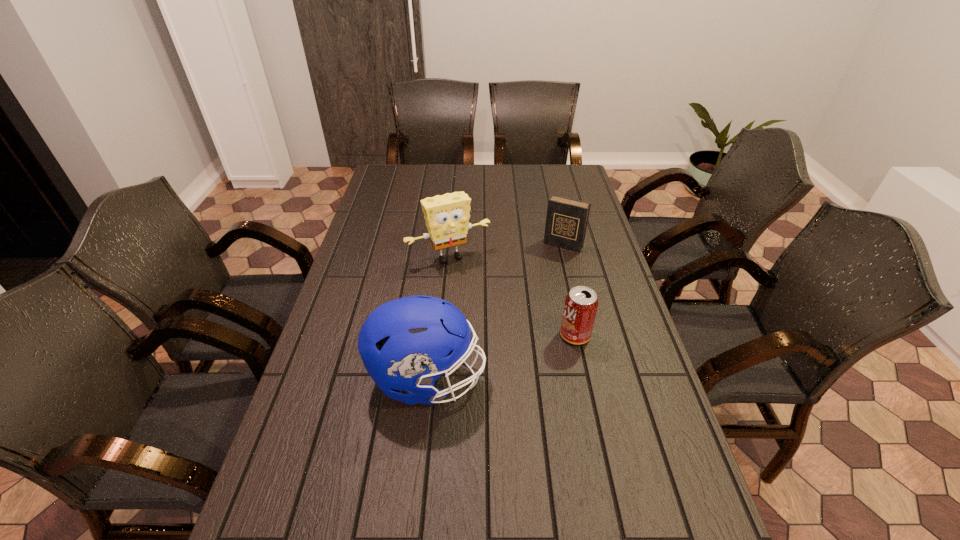
This screenshot has width=960, height=540. Identify the location of vacant area at the far right corner of the desktop. (548, 166).

What are the coordinates of `vacant space at the near right corner of the desktop` in the screenshot? It's located at (697, 520).

Locate an element on the screen. The width and height of the screenshot is (960, 540). vacant space that is in between the football helmet and the shortest object is located at coordinates (501, 357).

Locate an element on the screen. Image resolution: width=960 pixels, height=540 pixels. vacant region between the diary and the sponge is located at coordinates (506, 251).

You are a GUI agent. You are given a task and a screenshot of the screen. Output one action in this format:
    pyautogui.click(x=<x>, y=<y>)
    Task: Click on the free space between the diary and the sponge
    Image resolution: width=960 pixels, height=540 pixels.
    Given the screenshot: What is the action you would take?
    pyautogui.click(x=506, y=251)

The image size is (960, 540). Identify the location of empty space that is in between the football helmet and the shortest object. (501, 357).

Find the location of a particular element. vacant space in between the football helmet and the diary is located at coordinates (495, 312).

Where is `vacant space that's between the soda can and the football helmet`? The height and width of the screenshot is (540, 960). vacant space that's between the soda can and the football helmet is located at coordinates (501, 357).

Where is `unoccupied area between the sponge and the diary`? unoccupied area between the sponge and the diary is located at coordinates (506, 251).

Where is `blank region between the diary and the football helmet`? blank region between the diary and the football helmet is located at coordinates (495, 312).